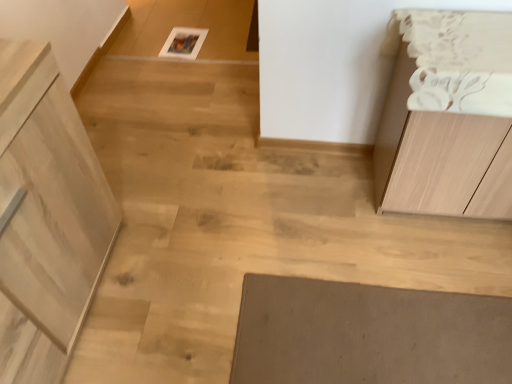
Identify the location of free point in front of light wood cabinet at right, the 1th cabinetry in the right-to-left sequence. The width and height of the screenshot is (512, 384). (444, 288).